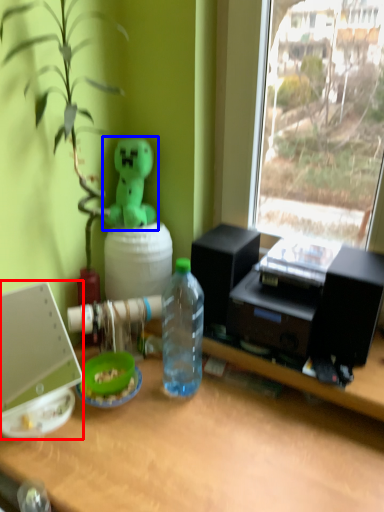
Question: Which object appears farthest to the camera in this image, laptop (highlighted by a red box) or toy (highlighted by a blue box)?

Choices:
 (A) laptop
 (B) toy

Answer: (B)